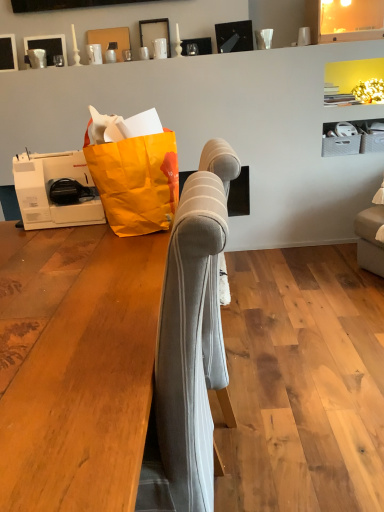
Question: From the image's perspective, does orange paper grocery bag at left appear lower than matte black picture frame at upper left, arranged as the second picture frame when viewed from the right?

Choices:
 (A) no
 (B) yes

Answer: (B)

Question: From a real-world perspective, is orange paper grocery bag at left below matte black picture frame at upper left, which is the 2th picture frame from left to right?

Choices:
 (A) no
 (B) yes

Answer: (B)

Question: Can you confirm if orange paper grocery bag at left is taller than matte black picture frame at upper left, arranged as the second picture frame when viewed from the right?

Choices:
 (A) no
 (B) yes

Answer: (B)

Question: Is matte black picture frame at upper left, which is the 2th picture frame from left to right, a part of orange paper grocery bag at left?

Choices:
 (A) no
 (B) yes

Answer: (A)

Question: Is orange paper grocery bag at left not inside matte black picture frame at upper left, which is the 2th picture frame from left to right?

Choices:
 (A) no
 (B) yes

Answer: (B)

Question: Considering the positions of matte black picture frame at upper center, the first picture frame from the right, and matte black picture frame at upper left, which ranks as the 1th picture frame in left-to-right order, in the image, is matte black picture frame at upper center, the first picture frame from the right, taller or shorter than matte black picture frame at upper left, which ranks as the 1th picture frame in left-to-right order,?

Choices:
 (A) short
 (B) tall

Answer: (A)

Question: Does point (147, 46) appear closer or farther from the camera than point (16, 66)?

Choices:
 (A) farther
 (B) closer

Answer: (A)

Question: Considering the relative positions of matte black picture frame at upper center, the third picture frame viewed from the left, and matte black picture frame at upper left, acting as the 3th picture frame starting from the right, in the image provided, is matte black picture frame at upper center, the third picture frame viewed from the left, to the left or to the right of matte black picture frame at upper left, acting as the 3th picture frame starting from the right,?

Choices:
 (A) left
 (B) right

Answer: (B)

Question: Looking at the image, does matte black picture frame at upper center, the first picture frame from the right, seem bigger or smaller compared to matte black picture frame at upper left, which ranks as the 1th picture frame in left-to-right order?

Choices:
 (A) big
 (B) small

Answer: (B)

Question: From a real-world perspective, is matte black picture frame at upper left, arranged as the second picture frame when viewed from the right, physically located above or below matte black picture frame at upper left, acting as the 3th picture frame starting from the right?

Choices:
 (A) above
 (B) below

Answer: (B)

Question: In the image, is matte black picture frame at upper left, arranged as the second picture frame when viewed from the right, on the left side or the right side of matte black picture frame at upper left, acting as the 3th picture frame starting from the right?

Choices:
 (A) left
 (B) right

Answer: (B)

Question: Choose the correct answer: Is matte black picture frame at upper left, which is the 2th picture frame from left to right, inside matte black picture frame at upper left, acting as the 3th picture frame starting from the right, or outside it?

Choices:
 (A) inside
 (B) outside

Answer: (B)

Question: Is matte black picture frame at upper left, arranged as the second picture frame when viewed from the right, bigger or smaller than matte black picture frame at upper left, acting as the 3th picture frame starting from the right?

Choices:
 (A) big
 (B) small

Answer: (A)

Question: Considering the positions of point (14, 478) and point (26, 48), is point (14, 478) closer or farther from the camera than point (26, 48)?

Choices:
 (A) farther
 (B) closer

Answer: (B)

Question: Is light gray fabric sofa at center inside or outside of matte black picture frame at upper left, arranged as the second picture frame when viewed from the right?

Choices:
 (A) outside
 (B) inside

Answer: (A)